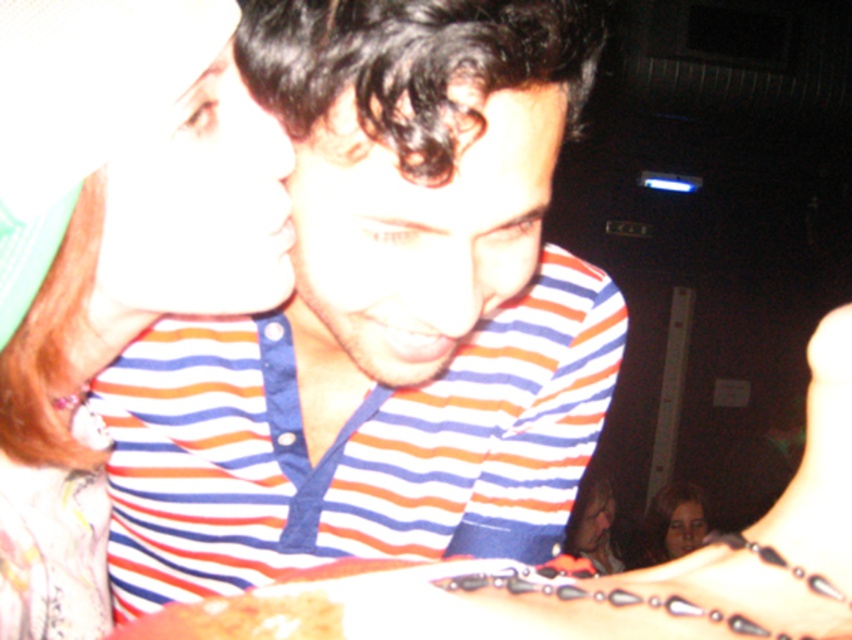
Can you confirm if brown crumbly bread at lower left is taller than smooth skin face at lower right?

Incorrect, brown crumbly bread at lower left's height is not larger of smooth skin face at lower right's.

Who is higher up, brown crumbly bread at lower left or smooth skin face at lower right?

Positioned higher is brown crumbly bread at lower left.

Between point (317, 637) and point (659, 516), which one is positioned in front?

Point (317, 637) is in front.

Where is `brown crumbly bread at lower left`? brown crumbly bread at lower left is located at coordinates (240, 618).

Does point (458, 358) come behind point (222, 49)?

Yes, point (458, 358) is farther from viewer.

Is striped fabric shirt at center below matte striped shirt at upper left?

Yes, striped fabric shirt at center is below matte striped shirt at upper left.

Who is more distant from viewer, (383, 116) or (250, 124)?

Positioned behind is point (250, 124).

Where is `striped fabric shirt at center`? The image size is (852, 640). striped fabric shirt at center is located at coordinates (380, 316).

Is striped fabric shirt at center wider than matte black hair at lower right?

Correct, the width of striped fabric shirt at center exceeds that of matte black hair at lower right.

Is striped fabric shirt at center bigger than matte black hair at lower right?

Actually, striped fabric shirt at center might be smaller than matte black hair at lower right.

Where is `striped fabric shirt at center`? This screenshot has width=852, height=640. striped fabric shirt at center is located at coordinates (380, 316).